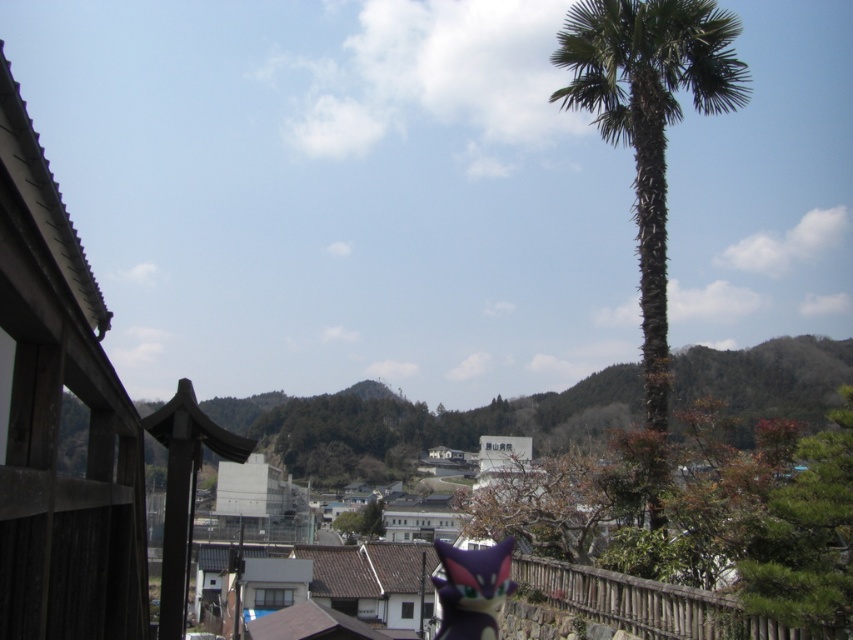
Question: Estimate the real-world distances between objects in this image. Which object is closer to the green leafy palm at right?

Choices:
 (A) purple matte plush toy at center
 (B) brown wooden rail at lower right
 (C) green leafy tree at center

Answer: (C)

Question: Where is green leafy tree at center located in relation to green leafy palm at right in the image?

Choices:
 (A) right
 (B) left

Answer: (B)

Question: Which of the following is the farthest from the observer?

Choices:
 (A) brown wooden rail at lower right
 (B) green leafy tree at center

Answer: (A)

Question: Where is green leafy tree at center located in relation to green leafy palm at right in the image?

Choices:
 (A) right
 (B) left

Answer: (B)

Question: Observing the image, what is the correct spatial positioning of green leafy palm at right in reference to brown wooden rail at lower right?

Choices:
 (A) above
 (B) below

Answer: (A)

Question: Which point is closer to the camera?

Choices:
 (A) green leafy tree at center
 (B) green leafy palm at right
 (C) purple matte plush toy at center
 (D) brown wooden rail at lower right

Answer: (A)